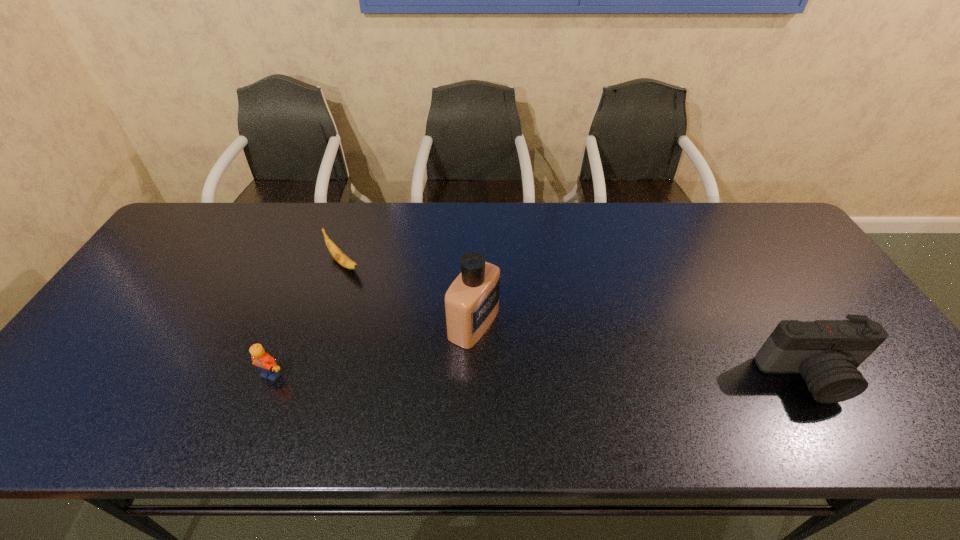
Find the location of `the third tallest object`. the third tallest object is located at coordinates (270, 370).

The height and width of the screenshot is (540, 960). What are the coordinates of `the second tallest object` in the screenshot? It's located at (827, 353).

You are a GUI agent. You are given a task and a screenshot of the screen. Output one action in this format:
    pyautogui.click(x=<x>, y=<y>)
    Task: Click on the rightmost object
    
    Given the screenshot: What is the action you would take?
    pyautogui.click(x=827, y=353)

The image size is (960, 540). What are the coordinates of `the shortest object` in the screenshot? It's located at (338, 255).

Image resolution: width=960 pixels, height=540 pixels. Identify the location of the farthest object. (338, 255).

Locate an element on the screen. The image size is (960, 540). the second farthest object is located at coordinates (472, 301).

What are the coordinates of `the third object from left to right` in the screenshot? It's located at click(472, 301).

At what (x,y) coordinates should I click in order to perform the action: click on vacant space located on the peel of the banana from the top. Please return your answer as a coordinate pair (x, y). This screenshot has width=960, height=540. Looking at the image, I should click on (365, 282).

At what (x,y) coordinates should I click in order to perform the action: click on free space located 0.080m on the peel of the banana from the top. Please return your answer as a coordinate pair (x, y). The width and height of the screenshot is (960, 540). Looking at the image, I should click on coord(371,288).

Locate an element on the screen. vacant position located on the peel of the banana from the top is located at coordinates (417, 330).